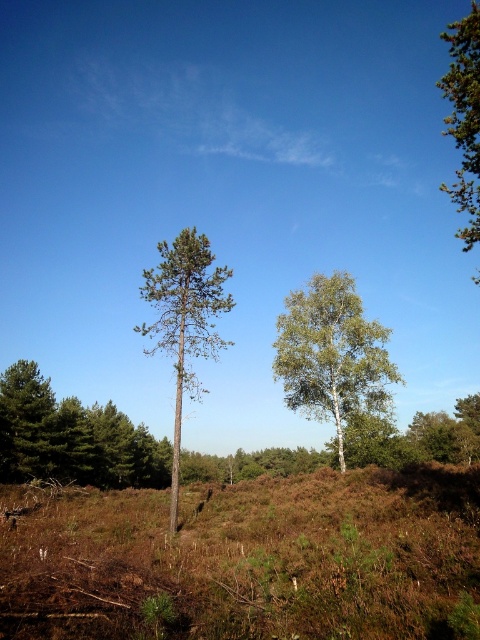
Question: Is white smooth birch tree at center positioned in front of green needle-like at upper right?

Choices:
 (A) yes
 (B) no

Answer: (B)

Question: Which object is positioned closest to the brown grassy hillside at center?

Choices:
 (A) smooth white birch at center
 (B) green needle-like at upper right

Answer: (A)

Question: Does white smooth birch tree at center appear on the right side of smooth white birch at center?

Choices:
 (A) no
 (B) yes

Answer: (B)

Question: Can you confirm if smooth white birch at center is positioned below green needle-like at upper right?

Choices:
 (A) yes
 (B) no

Answer: (A)

Question: Which point is farther to the camera?

Choices:
 (A) brown grassy hillside at center
 (B) smooth white birch at center
 (C) white smooth birch tree at center
 (D) green needle-like at upper right

Answer: (C)

Question: Estimate the real-world distances between objects in this image. Which object is closer to the green matte tree at center?

Choices:
 (A) green needle-like at upper right
 (B) smooth white birch at center
 (C) brown grassy hillside at center

Answer: (B)